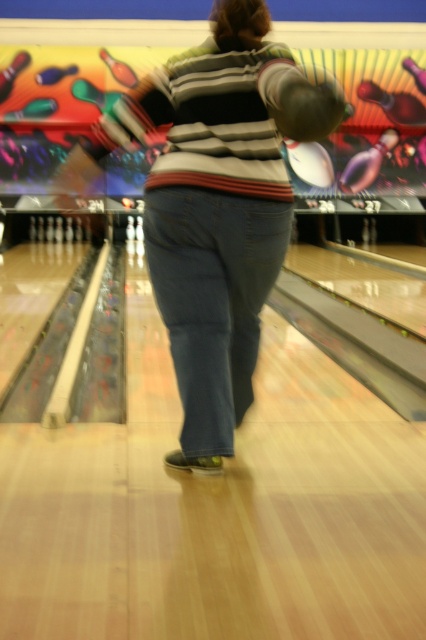
Question: Which point is farther to the camera?

Choices:
 (A) striped sweater at center
 (B) denim at center

Answer: (B)

Question: Is striped sweater at center further to the viewer compared to denim at center?

Choices:
 (A) yes
 (B) no

Answer: (B)

Question: Which object is closer to the camera taking this photo?

Choices:
 (A) denim at center
 (B) striped sweater at center

Answer: (B)

Question: Does striped sweater at center appear on the right side of denim at center?

Choices:
 (A) no
 (B) yes

Answer: (B)

Question: Is striped sweater at center wider than denim at center?

Choices:
 (A) no
 (B) yes

Answer: (B)